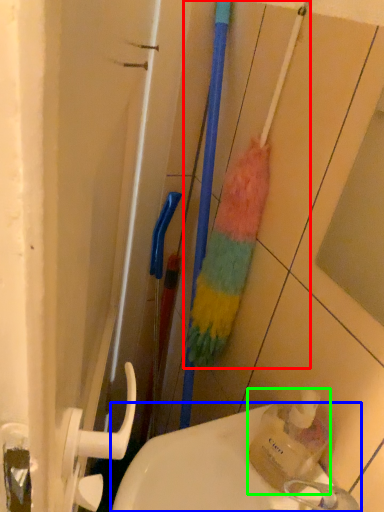
Question: Which object is positioned closest to brush (highlighted by a red box)? Select from sink (highlighted by a blue box) and bottle (highlighted by a green box).

Choices:
 (A) sink
 (B) bottle

Answer: (B)